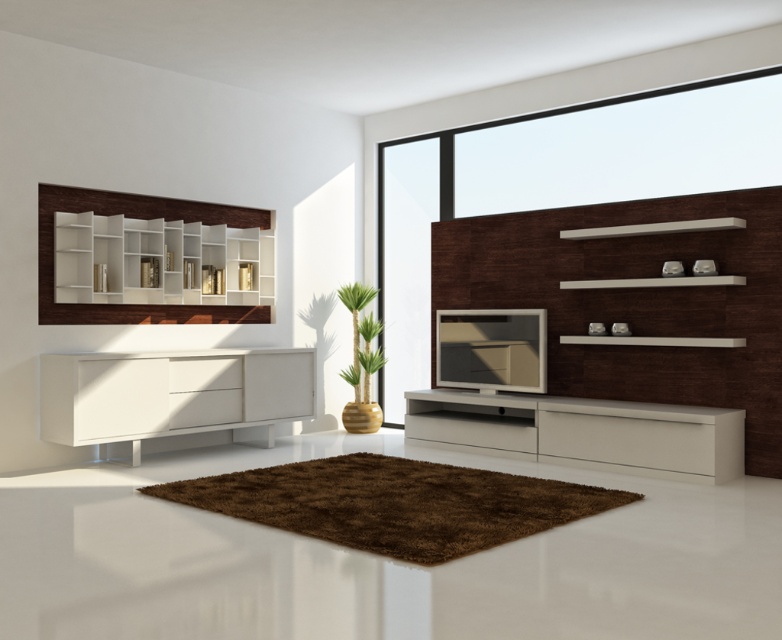
Find the location of `white glossy tv stand at center`. white glossy tv stand at center is located at coordinates (583, 432).

The height and width of the screenshot is (640, 782). Identify the location of white glossy tv stand at center. (583, 432).

Can you confirm if white matte sideboard at left is smaller than white glossy tv stand at center?

Incorrect, white matte sideboard at left is not smaller in size than white glossy tv stand at center.

Does white matte sideboard at left have a greater width compared to white glossy tv stand at center?

In fact, white matte sideboard at left might be narrower than white glossy tv stand at center.

Who is more distant from viewer, (x=266, y=353) or (x=723, y=412)?

The point (x=266, y=353) is behind.

Image resolution: width=782 pixels, height=640 pixels. I want to click on white matte sideboard at left, so click(x=170, y=394).

Which of these two, white matte sideboard at left or white wood shelves at upper left, stands shorter?

white matte sideboard at left

Can you confirm if white matte sideboard at left is positioned to the right of white wood shelves at upper left?

Indeed, white matte sideboard at left is positioned on the right side of white wood shelves at upper left.

Image resolution: width=782 pixels, height=640 pixels. Identify the location of white matte sideboard at left. (170, 394).